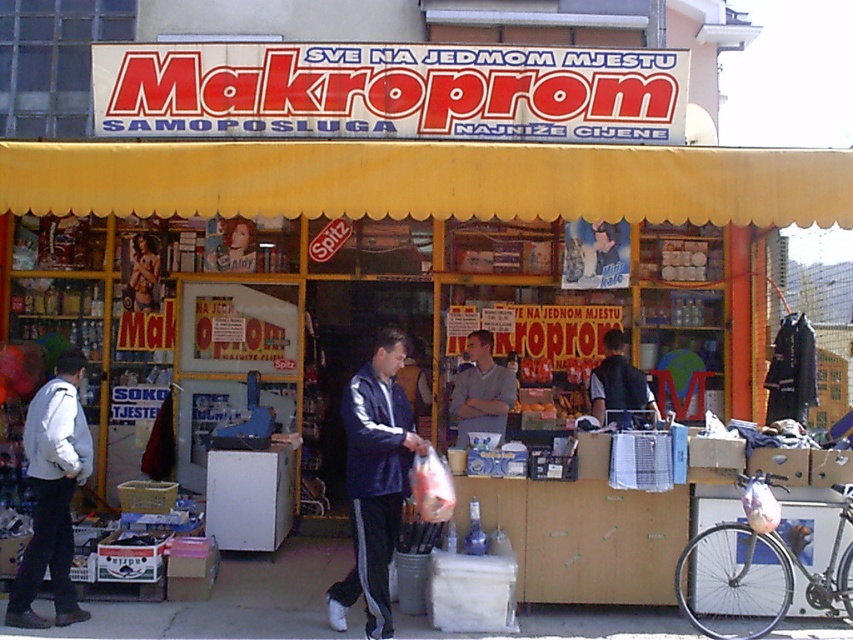
You are a customer entering the store and see the yellow fabric canopy at upper center and the light gray jacket at left. Which object is located above the other?

The yellow fabric canopy at upper center is positioned over the light gray jacket at left, meaning it is above it.

You are standing in front of the Makroprom store and looking at two points inside the store through the glass doors. The first point is at coordinates point (602, 150) and the second is at point (461, 413). Which point is closer to you?

Point (602, 150) is closer to the camera than point (461, 413), so the first point is closer to you.

You are a customer standing outside the Makroprom store. You notice two items in the window display. Which item is taller between the yellow fabric canopy at upper center and the light gray sweater at center?

The light gray sweater at center is taller than the yellow fabric canopy at upper center.